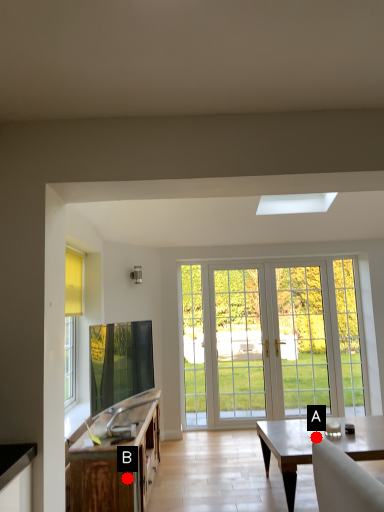
Question: Two points are circled on the image, labeled by A and B beside each circle. Which point is closer to the camera?

Choices:
 (A) A is closer
 (B) B is closer

Answer: (B)